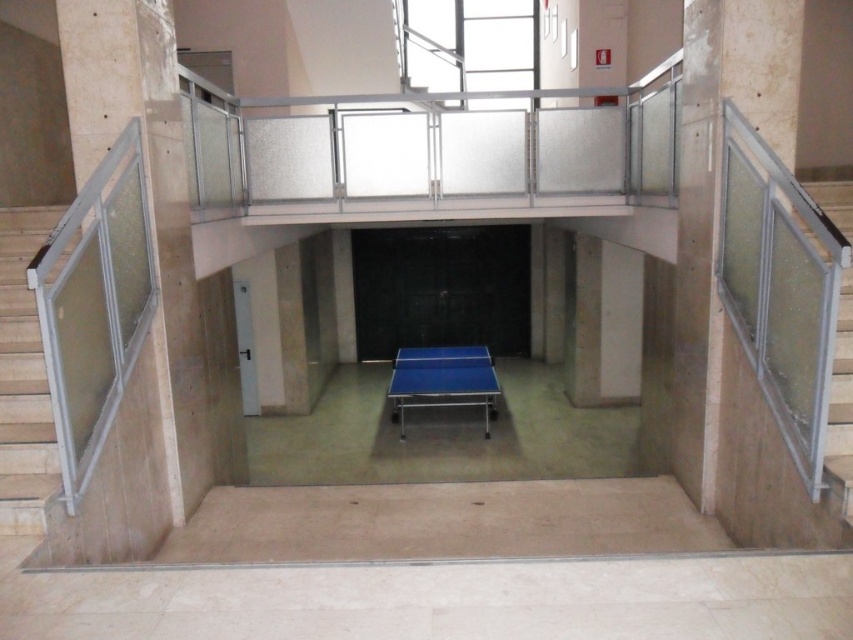
You are a maintenance worker needing to reach both the metallic gray handrail at left and the blue rubber table tennis table at center. Given that your ladder can extend up to 6 meters, will you be able to safely reach both objects without moving the ladder?

The metallic gray handrail at left and blue rubber table tennis table at center are 5.85 meters apart, so yes, the ladder can safely reach both objects as the distance between them is within the ladder extension limit.

You are standing at the ping pong table in the enclosed area and want to reach a point marked as point (469, 360). Is the point marked as point (16, 264) closer to you than the point you want to reach?

Point (16, 264) is in front of point (469, 360), so yes, the point (16, 264) is closer to you than the point (469, 360).

You are standing on the raised platform with the glass railing. You want to walk to the ping pong table below. Is the point represented by point (x=840, y=412) directly above the ping pong table?

The clear glass railing at right is represented by point (x=840, y=412). Since the ping pong table is centrally positioned in the enclosed area below, the point is not directly above the table but rather to the right side of it.